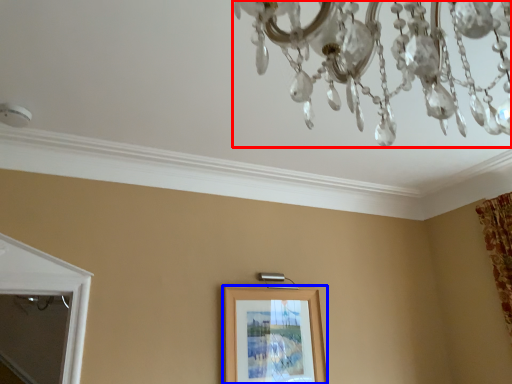
Question: Among these objects, which one is farthest to the camera, chandelier (highlighted by a red box) or picture frame (highlighted by a blue box)?

Choices:
 (A) chandelier
 (B) picture frame

Answer: (B)